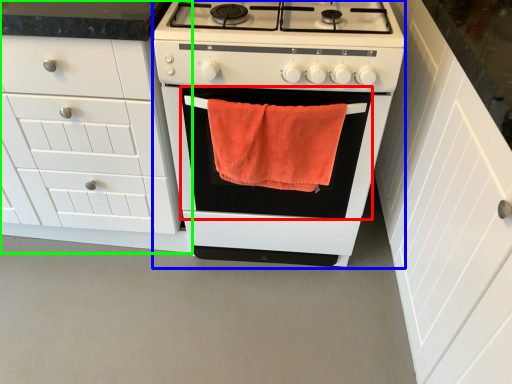
Question: Which object is positioned farthest from oven (highlighted by a red box)? Select from appliance (highlighted by a blue box) and cabinetry (highlighted by a green box).

Choices:
 (A) appliance
 (B) cabinetry

Answer: (B)